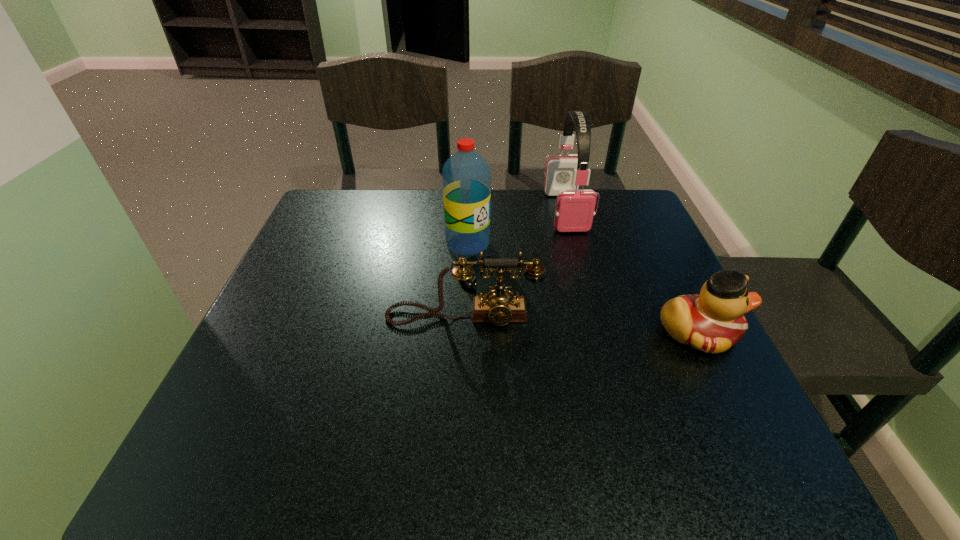
You are a GUI agent. You are given a task and a screenshot of the screen. Output one action in this format:
    pyautogui.click(x=<x>, y=<y>)
    Task: Click on the telephone
    The width and height of the screenshot is (960, 540).
    Given the screenshot: What is the action you would take?
    pyautogui.click(x=500, y=307)

This screenshot has height=540, width=960. In order to click on the rightmost object in this screenshot , I will do `click(712, 322)`.

Identify the location of water bottle. (466, 177).

Find the location of a particular element. the second object from right to left is located at coordinates (574, 211).

Find the location of a particular element. free location located on the front-facing side of the telephone is located at coordinates (462, 372).

Image resolution: width=960 pixels, height=540 pixels. I want to click on free space located on the front label of the water bottle, so click(x=557, y=335).

Locate an element on the screen. blank space located 0.120m on the front label of the water bottle is located at coordinates (508, 285).

Where is `blank space located on the front label of the water bottle`? Image resolution: width=960 pixels, height=540 pixels. blank space located on the front label of the water bottle is located at coordinates (578, 355).

Locate an element on the screen. This screenshot has height=540, width=960. vacant space situated on the outer surface of the earphone is located at coordinates coord(596,308).

At what (x,y) coordinates should I click in order to perform the action: click on vacant space positioned 0.100m on the outer surface of the earphone. Please return your answer as a coordinate pair (x, y). The width and height of the screenshot is (960, 540). Looking at the image, I should click on (581, 259).